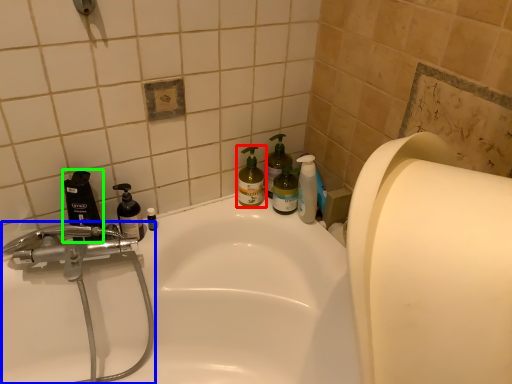
Question: Estimate the real-world distances between objects in this image. Which object is closer to cleaning product (highlighted by a red box), plumbing fixture (highlighted by a blue box) or mouthwash (highlighted by a green box)?

Choices:
 (A) plumbing fixture
 (B) mouthwash

Answer: (B)